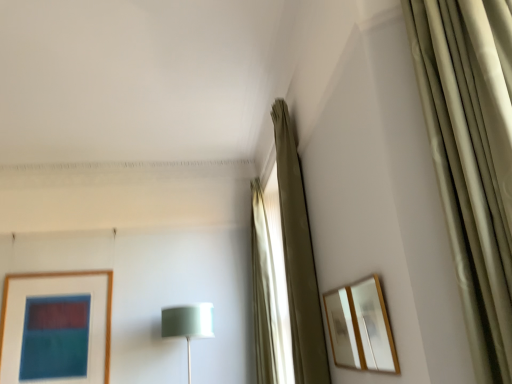
Question: Considering the positions of beige fabric curtain at upper right, acting as the second curtain starting from the back, and satin green shade at center in the image, is beige fabric curtain at upper right, acting as the second curtain starting from the back, wider or thinner than satin green shade at center?

Choices:
 (A) wide
 (B) thin

Answer: (B)

Question: Considering the relative positions of beige fabric curtain at upper right, acting as the second curtain starting from the back, and satin green shade at center in the image provided, is beige fabric curtain at upper right, acting as the second curtain starting from the back, to the left or to the right of satin green shade at center?

Choices:
 (A) left
 (B) right

Answer: (B)

Question: Estimate the real-world distances between objects in this image. Which object is farther from the satin green shade at center?

Choices:
 (A) wooden-framed mirror at right, the second picture frame positioned from the back
 (B) wooden mirror at upper right, arranged as the 2th picture frame when viewed from the front
 (C) beige fabric curtain at upper right, acting as the first curtain starting from the front
 (D) beige fabric curtain at center, which ranks as the 1th curtain in back-to-front order

Answer: (A)

Question: Considering the real-world distances, which object is farthest from the beige fabric curtain at center, which is the second curtain from front to back?

Choices:
 (A) beige fabric curtain at upper right, acting as the second curtain starting from the back
 (B) satin green shade at center
 (C) wooden mirror at upper right, arranged as the 2th picture frame when viewed from the front
 (D) wooden-framed mirror at right, the first picture frame positioned from the front

Answer: (D)